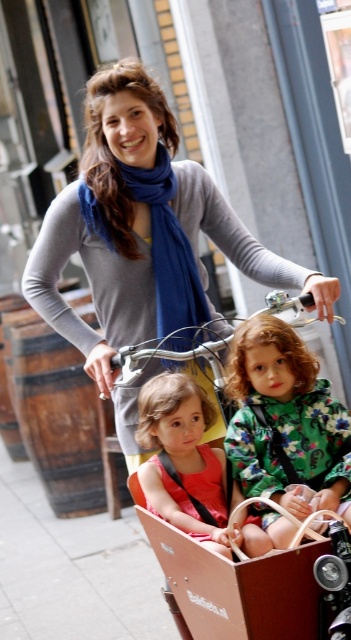
Is matte gray sweater at center to the left of matte pink dress at center from the viewer's perspective?

Correct, you'll find matte gray sweater at center to the left of matte pink dress at center.

Does matte gray sweater at center have a lesser height compared to matte pink dress at center?

Incorrect, matte gray sweater at center's height does not fall short of matte pink dress at center's.

At what (x,y) coordinates should I click in order to perform the action: click on matte gray sweater at center. Please return your answer as a coordinate pair (x, y). Looking at the image, I should click on (143, 230).

Can you confirm if floral-patterned fabric at center is positioned above matte pink dress at center?

Yes, floral-patterned fabric at center is above matte pink dress at center.

This screenshot has height=640, width=351. In order to click on floral-patterned fabric at center in this screenshot , I will do click(286, 420).

The height and width of the screenshot is (640, 351). I want to click on matte gray sweater at center, so click(143, 230).

Is point (175, 243) closer to camera compared to point (334, 456)?

That is False.

Identify the location of matte gray sweater at center. The width and height of the screenshot is (351, 640). (143, 230).